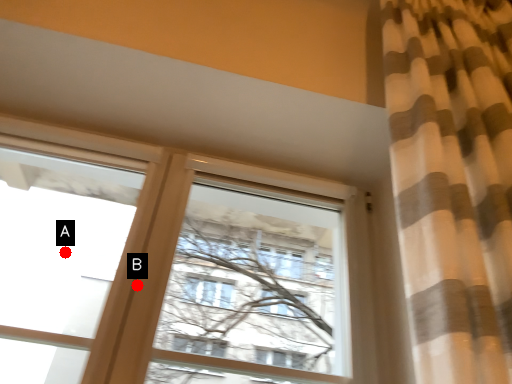
Question: Two points are circled on the image, labeled by A and B beside each circle. Which point is farther from the camera taking this photo?

Choices:
 (A) A is further
 (B) B is further

Answer: (A)